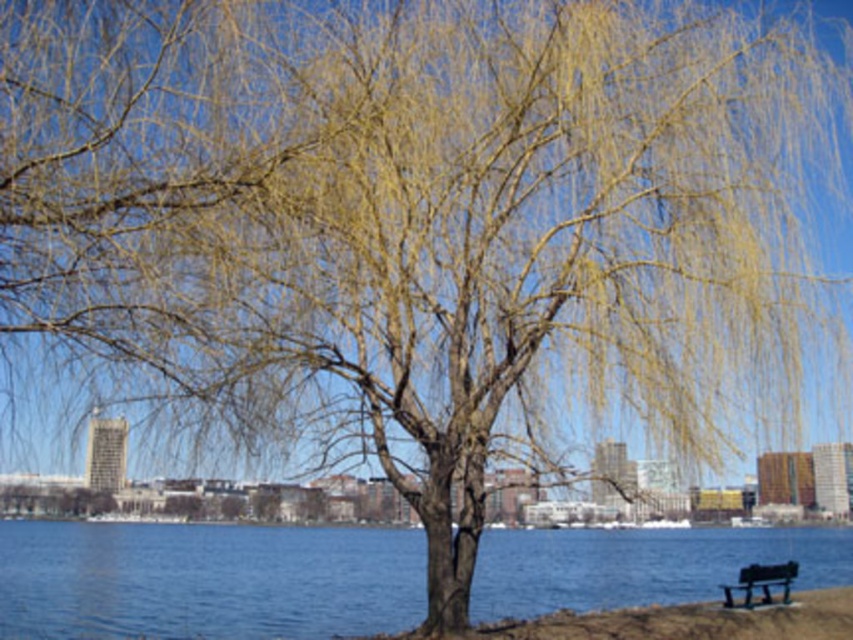
Question: Is the position of blue water at center more distant than that of green painted wood bench at lower right?

Choices:
 (A) yes
 (B) no

Answer: (B)

Question: Is blue water at center positioned in front of green painted wood bench at lower right?

Choices:
 (A) yes
 (B) no

Answer: (A)

Question: Which point is farther to the camera?

Choices:
 (A) blue water at center
 (B) green painted wood bench at lower right

Answer: (B)

Question: Does blue water at center appear under green painted wood bench at lower right?

Choices:
 (A) no
 (B) yes

Answer: (A)

Question: Among these points, which one is nearest to the camera?

Choices:
 (A) (795, 566)
 (B) (99, 616)

Answer: (B)